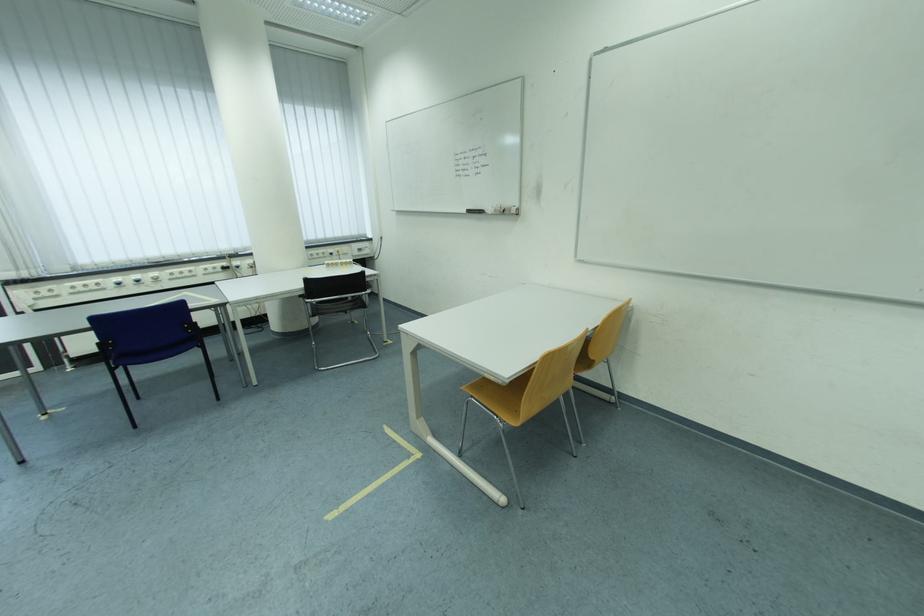
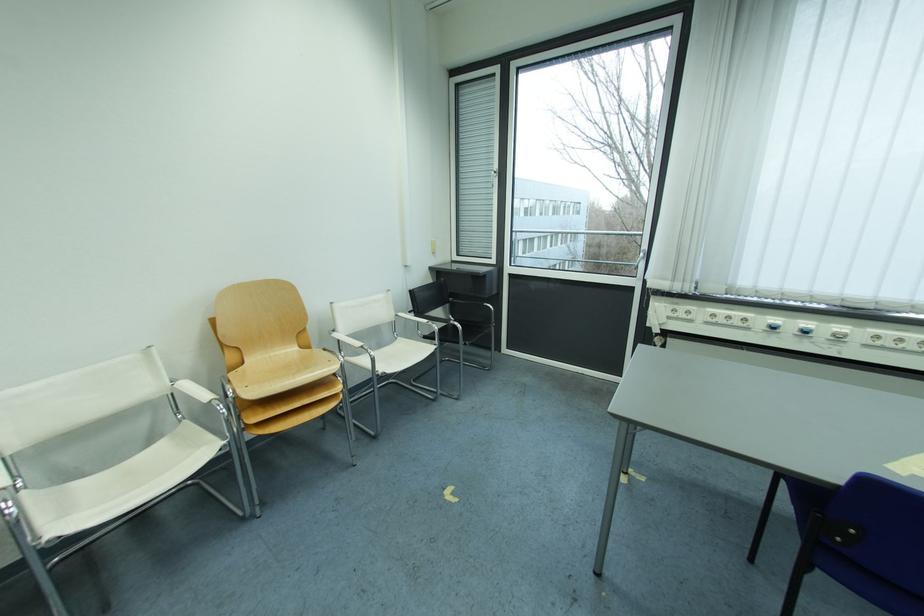
Where in the second image is the point corresponding to the point at 103,322 from the first image?

(883, 490)